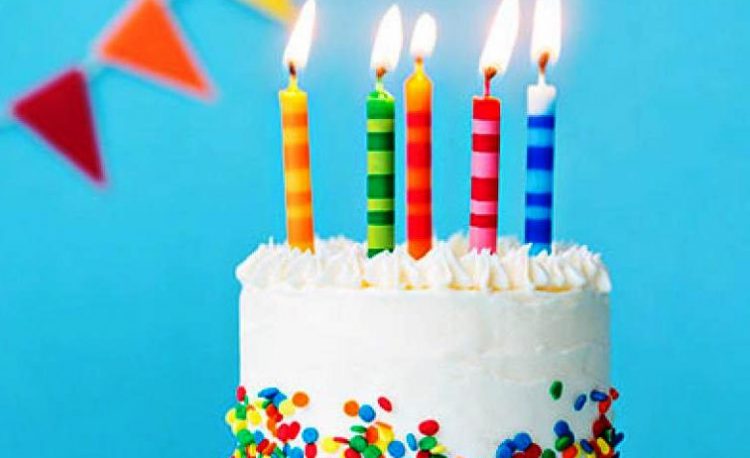
Where is `candle wicks`? candle wicks is located at coordinates (294, 68), (378, 76), (414, 58), (487, 81), (544, 65).